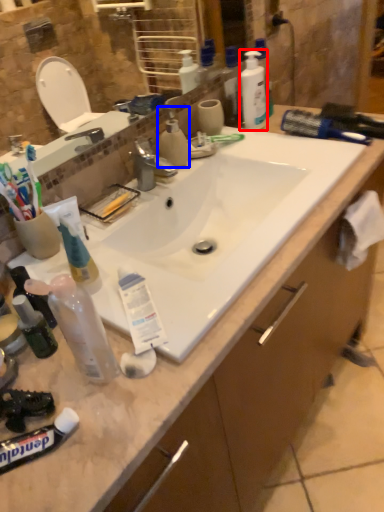
Question: Which object is further to the camera taking this photo, cleaning product (highlighted by a red box) or cleaning product (highlighted by a blue box)?

Choices:
 (A) cleaning product
 (B) cleaning product

Answer: (A)